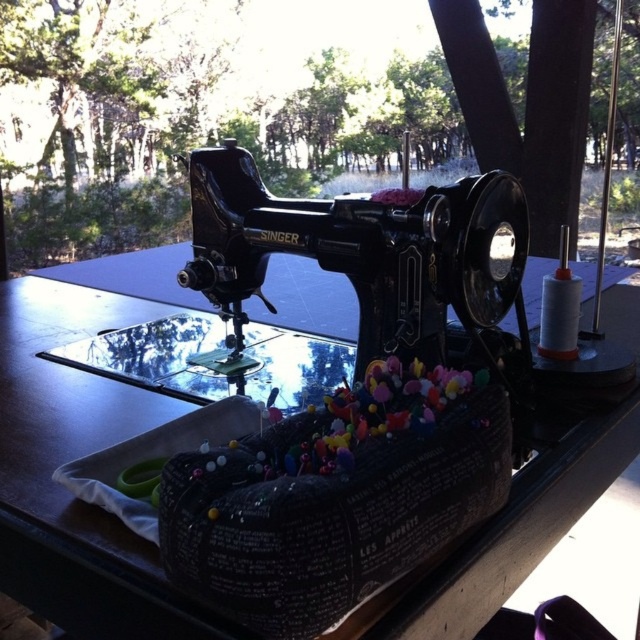
You are holding a 12 inch ruler and want to measure the distance from your current position to the point at coordinates point [465,388]. Can you reach it without moving your hand?

The point at coordinates point [465,388] is 21.26 inches away from you, so you cannot reach it with a 12 inch ruler without moving your hand.

You are standing in front of the vintage Singer sewing machine and want to place a fabric container on the black wood table at center. Based on the scene description, can you determine if the fabric container will fit on the table?

The black wood table at center is located at point (x=83, y=449), which indicates its position relative to the sewing machine. Since the fabric container is in front of the sewing machine, it is already positioned near the table. Therefore, the fabric container should fit on the black wood table at center as they are spatially aligned.

Looking at this image, you are standing at the point with coordinates point [298,380] and want to walk to the point with coordinates point [410,538]. According to the scene, which direction should you move in?

Point [410,538] is in front of point [298,380], so you should move forward to reach it.